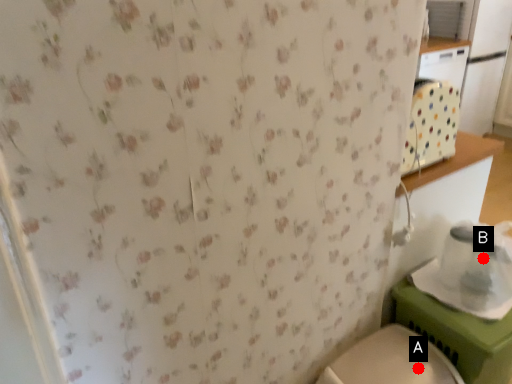
Question: Two points are circled on the image, labeled by A and B beside each circle. Which of the following is the farthest from the observer?

Choices:
 (A) A is further
 (B) B is further

Answer: (B)